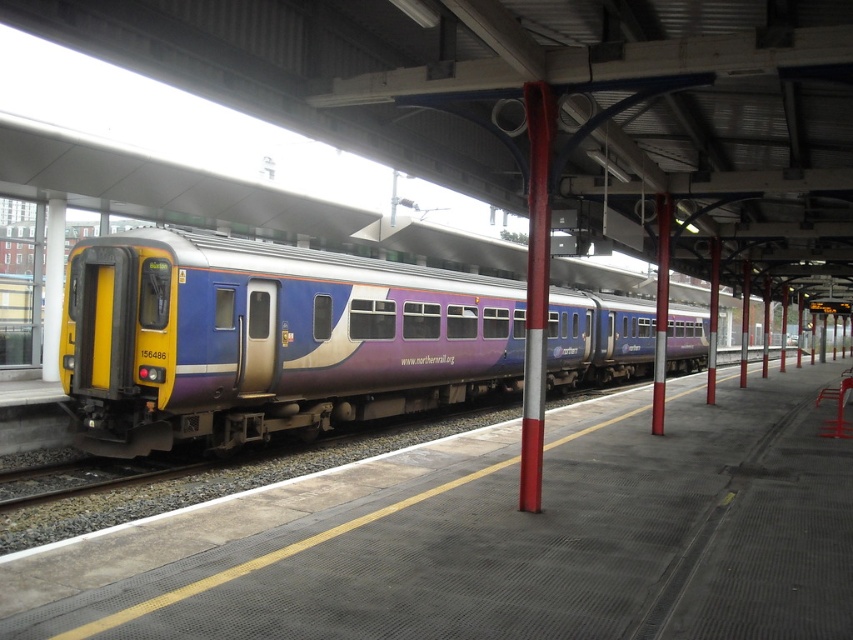
Question: Observing the image, what is the correct spatial positioning of metallic red pole at center in reference to metallic pole at center?

Choices:
 (A) below
 (B) above

Answer: (A)

Question: Which of these objects is positioned farthest from the metallic red pole at center?

Choices:
 (A) metallic pole at center
 (B) red metallic pole at center
 (C) purple glossy train at center

Answer: (B)

Question: Which point is farther from the camera taking this photo?

Choices:
 (A) (519, 499)
 (B) (131, 252)

Answer: (B)

Question: Can you confirm if purple glossy train at center is wider than metallic pole at center?

Choices:
 (A) no
 (B) yes

Answer: (B)

Question: Does metallic red pole at center have a larger size compared to metallic pole at center?

Choices:
 (A) yes
 (B) no

Answer: (B)

Question: Which point is closer to the camera?

Choices:
 (A) red metallic pole at center
 (B) purple glossy train at center

Answer: (A)